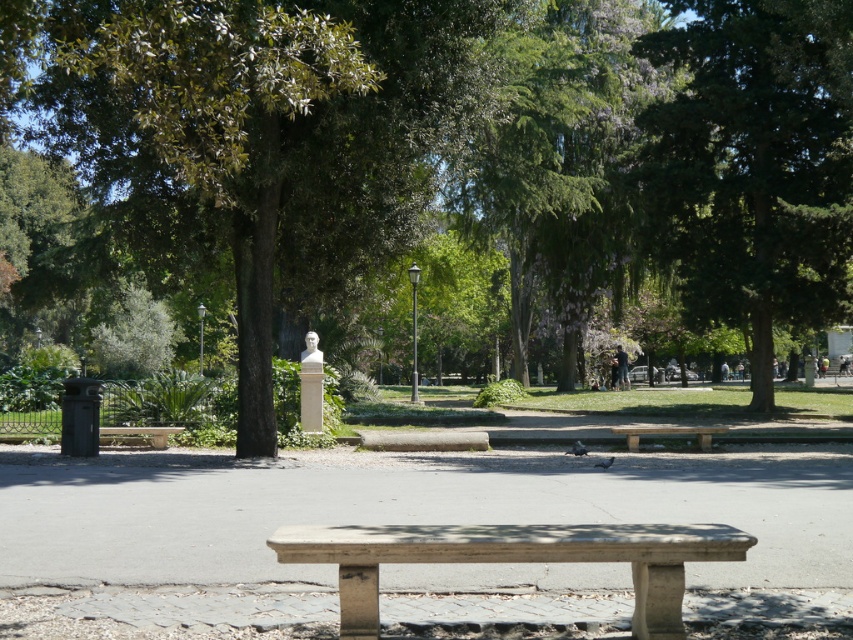
What are the coordinates of `smooth stone bench at center` in the screenshot? It's located at (514, 560).

Is smooth stone bench at center positioned in front of light brown stone bench at center?

Yes, smooth stone bench at center is in front of light brown stone bench at center.

Does point (700, 556) lie behind point (695, 428)?

No, (700, 556) is in front of (695, 428).

This screenshot has width=853, height=640. I want to click on smooth stone bench at center, so click(x=514, y=560).

Is point (709, 8) positioned before point (550, 540)?

No, (709, 8) is further to viewer.

Who is positioned more to the left, green leafy tree at upper right or smooth stone bench at center?

smooth stone bench at center is more to the left.

Does point (795, 300) come behind point (358, 554)?

Yes.

Where is `green leafy tree at upper right`? green leafy tree at upper right is located at coordinates (753, 164).

This screenshot has width=853, height=640. What do you see at coordinates (514, 560) in the screenshot?
I see `smooth stone bench at center` at bounding box center [514, 560].

Is point (743, 556) closer to camera compared to point (160, 436)?

Yes, point (743, 556) is closer to viewer.

Where is `smooth stone bench at center`? smooth stone bench at center is located at coordinates (514, 560).